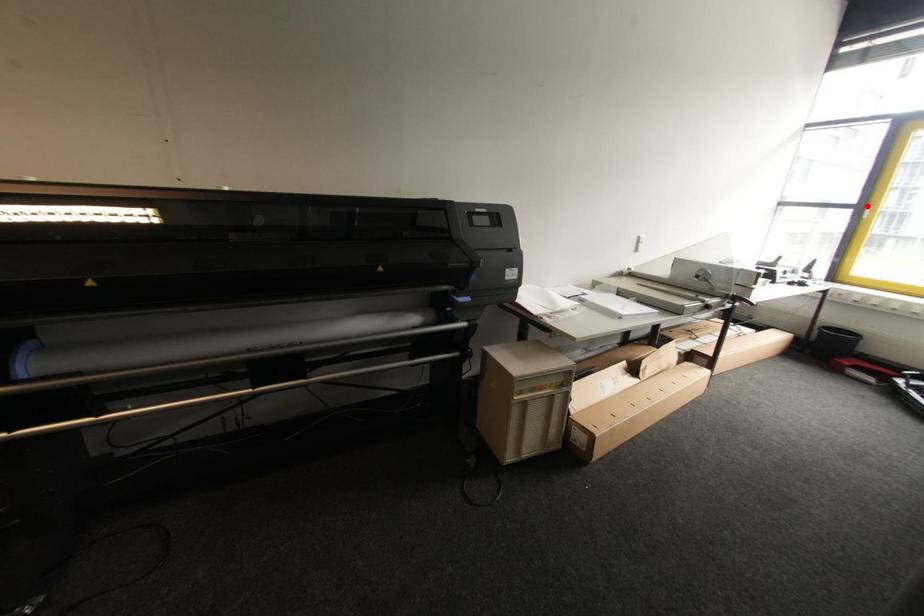
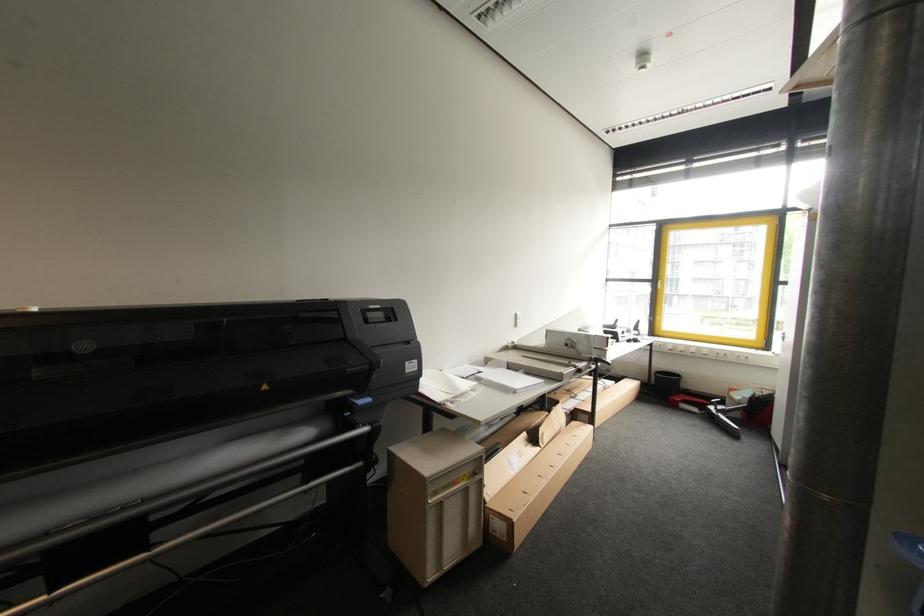
Question: I am providing you with two images of the same scene from different viewpoints. A red point is shown in image1. For the corresponding object point in image2, is it positioned nearer or farther from the camera?

Choices:
 (A) Nearer
 (B) Farther

Answer: (A)